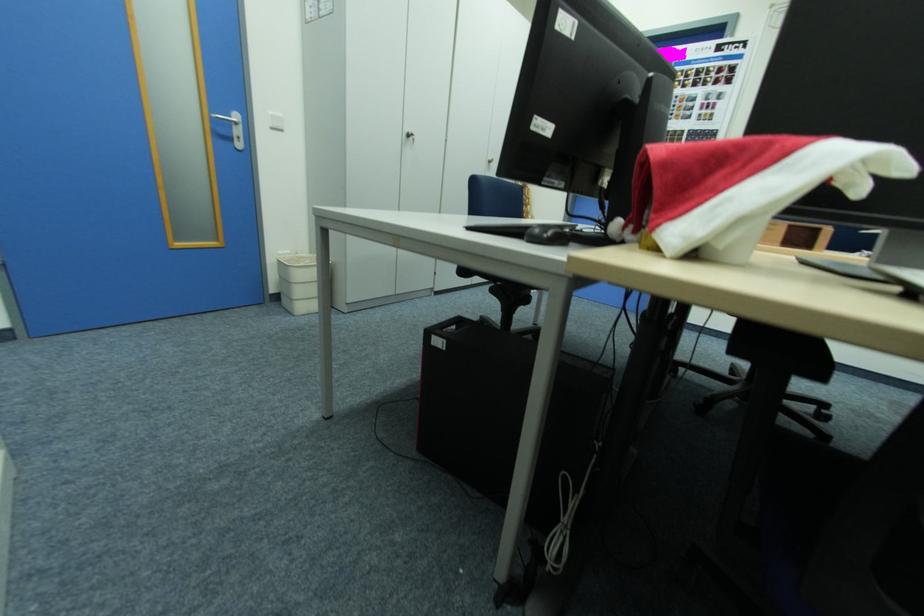
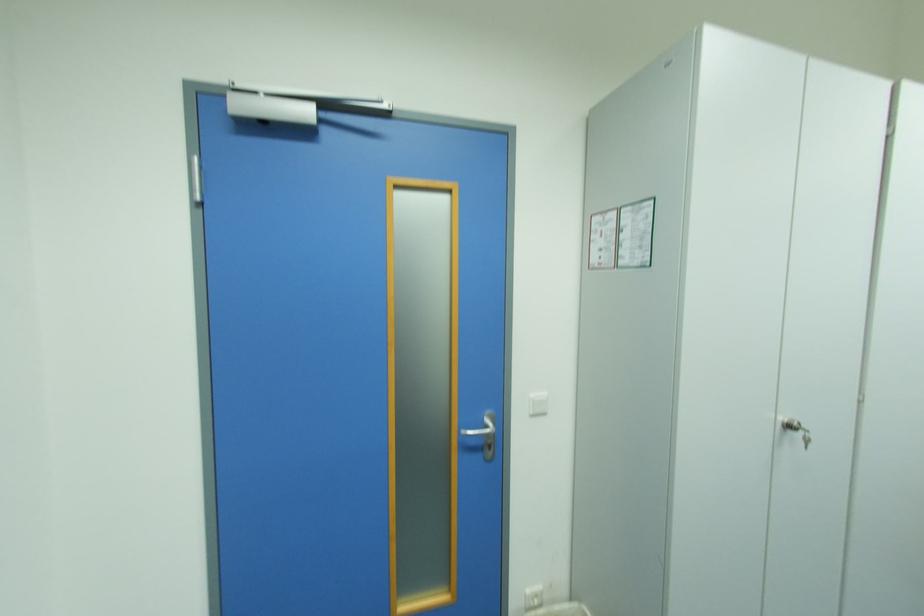
Find the pixel in the second image that matches point (277, 114) in the first image.

(540, 395)